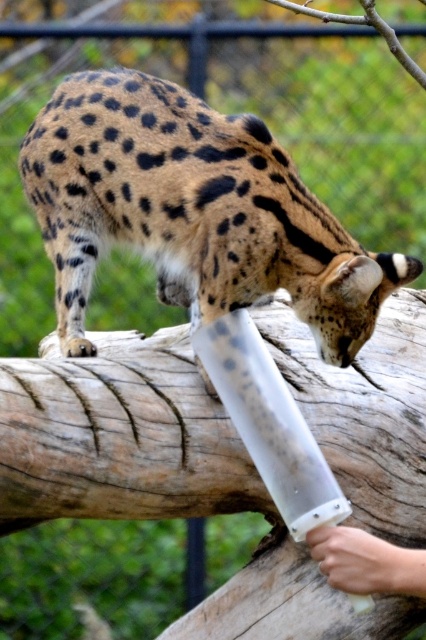
Is spotted fur cheetah at upper center positioned behind smooth skin hand at lower right?

Yes.

Find the location of `spotted fur cheetah at upper center`. spotted fur cheetah at upper center is located at coordinates (192, 211).

Who is more forward, (x=164, y=106) or (x=333, y=577)?

Positioned in front is point (x=333, y=577).

Image resolution: width=426 pixels, height=640 pixels. I want to click on spotted fur cheetah at upper center, so click(x=192, y=211).